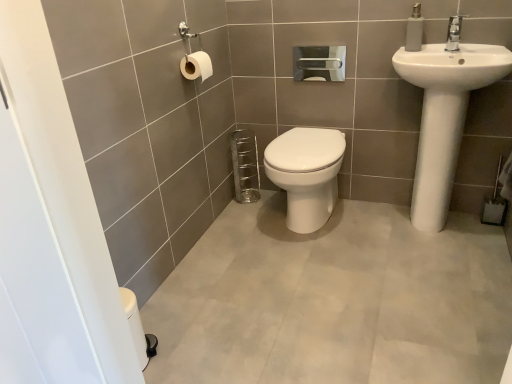
Describe the element at coordinates (414, 30) in the screenshot. I see `white matte soap dispenser at upper right` at that location.

What is the approximate height of white ceramic faucet at upper right?

white ceramic faucet at upper right is 5.00 inches in height.

Identify the location of white matte toilet paper at upper left, acting as the 2th toilet paper starting from the back. This screenshot has height=384, width=512. (196, 66).

Identify the location of white glossy toilet paper at upper center, which is counted as the first toilet paper, starting from the right. Image resolution: width=512 pixels, height=384 pixels. (319, 63).

From the image's perspective, is white matte toilet paper at upper left, acting as the 2th toilet paper starting from the back, above white glossy sink at upper right?

Yes, from the image's perspective, white matte toilet paper at upper left, acting as the 2th toilet paper starting from the back, is on top of white glossy sink at upper right.

From the picture: Considering the sizes of white matte toilet paper at upper left, acting as the 2th toilet paper starting from the back, and white glossy sink at upper right in the image, is white matte toilet paper at upper left, acting as the 2th toilet paper starting from the back, taller or shorter than white glossy sink at upper right?

In the image, white matte toilet paper at upper left, acting as the 2th toilet paper starting from the back, appears to be shorter than white glossy sink at upper right.

Is white matte toilet paper at upper left, the first toilet paper in the left-to-right sequence, turned away from white glossy sink at upper right?

No, white matte toilet paper at upper left, the first toilet paper in the left-to-right sequence, is not facing the opposite direction of white glossy sink at upper right.

Locate an element on the screen. The width and height of the screenshot is (512, 384). the 2nd toilet paper positioned above the white glossy sink at upper right (from a real-world perspective) is located at coordinates (196, 66).

From the picture: From the image's perspective, would you say white ceramic faucet at upper right is positioned over white glossy sink at upper right?

Yes.

Where is `sink below the white ceramic faucet at upper right (from the image's perspective)`? This screenshot has width=512, height=384. sink below the white ceramic faucet at upper right (from the image's perspective) is located at coordinates (444, 117).

How distant is white ceramic faucet at upper right from white glossy sink at upper right?

A distance of 11.04 inches exists between white ceramic faucet at upper right and white glossy sink at upper right.

From the image's perspective, is white matte soap dispenser at upper right above white glossy sink at upper right?

Yes, from the image's perspective, white matte soap dispenser at upper right is above white glossy sink at upper right.

Which of these two, white matte soap dispenser at upper right or white glossy sink at upper right, is bigger?

white glossy sink at upper right.

Who is shorter, white matte soap dispenser at upper right or white glossy sink at upper right?

With less height is white matte soap dispenser at upper right.

Is white matte soap dispenser at upper right situated inside white glossy sink at upper right or outside?

white matte soap dispenser at upper right is not inside white glossy sink at upper right, it's outside.

I want to click on soap dispenser above the white glossy sink at upper right (from a real-world perspective), so click(x=414, y=30).

Who is smaller, white glossy sink at upper right or white matte soap dispenser at upper right?

white matte soap dispenser at upper right is smaller.

Are white glossy sink at upper right and white matte soap dispenser at upper right located far from each other?

white glossy sink at upper right is near white matte soap dispenser at upper right, not far away.

Which is behind, point (403, 76) or point (413, 35)?

Positioned behind is point (413, 35).

Is white matte soap dispenser at upper right further to the viewer compared to white glossy toilet at center?

No, it is not.

Measure the distance from white matte soap dispenser at upper right to white glossy toilet at center.

The distance of white matte soap dispenser at upper right from white glossy toilet at center is 26.87 inches.

Would you say white matte soap dispenser at upper right is inside or outside white glossy toilet at center?

white matte soap dispenser at upper right is spatially situated outside white glossy toilet at center.

In terms of height, does white matte soap dispenser at upper right look taller or shorter compared to white glossy toilet at center?

Considering their sizes, white matte soap dispenser at upper right has less height than white glossy toilet at center.

Considering the sizes of objects white matte toilet paper at upper left, acting as the first toilet paper starting from the front, and white glossy toilet at center in the image provided, who is bigger, white matte toilet paper at upper left, acting as the first toilet paper starting from the front, or white glossy toilet at center?

white glossy toilet at center is bigger.

Between white matte toilet paper at upper left, acting as the first toilet paper starting from the front, and white glossy toilet at center, which one appears on the right side from the viewer's perspective?

white glossy toilet at center is more to the right.

Consider the image. From the image's perspective, which one is positioned higher, white matte toilet paper at upper left, the 2th toilet paper in the right-to-left sequence, or white glossy toilet at center?

white matte toilet paper at upper left, the 2th toilet paper in the right-to-left sequence.

Which object is further away from the camera, white glossy toilet at center or white glossy toilet at center?

Positioned behind is white glossy toilet at center.

Considering the relative sizes of white glossy toilet at center and white glossy toilet at center in the image provided, is white glossy toilet at center smaller than white glossy toilet at center?

Correct, white glossy toilet at center occupies less space than white glossy toilet at center.

Considering the relative positions of white glossy toilet at center and white glossy toilet at center in the image provided, is white glossy toilet at center to the left or to the right of white glossy toilet at center?

white glossy toilet at center is positioned on white glossy toilet at center's right side.

The image size is (512, 384). I want to click on sink that appears in front of the white matte toilet paper at upper left, acting as the 2th toilet paper starting from the back, so click(x=444, y=117).

The height and width of the screenshot is (384, 512). Identify the location of tap positioned vertically above the white glossy sink at upper right (from a real-world perspective). (454, 33).

Looking at the image, which one is located further to white glossy toilet at center, white matte toilet paper at upper left, acting as the first toilet paper starting from the front, or white matte soap dispenser at upper right?

white matte soap dispenser at upper right is further to white glossy toilet at center.

When comparing their distances from white glossy toilet at center, does white glossy sink at upper right or white glossy toilet paper at upper center, marked as the 2th toilet paper in a front-to-back arrangement, seem further?

Among the two, white glossy sink at upper right is located further to white glossy toilet at center.

Considering their positions, is white glossy sink at upper right positioned closer to white glossy toilet at center than white matte toilet paper at upper left, the first toilet paper in the left-to-right sequence?

white glossy sink at upper right is closer to white glossy toilet at center.

Estimate the real-world distances between objects in this image. Which object is closer to white glossy toilet paper at upper center, marked as the 2th toilet paper in a front-to-back arrangement, white matte soap dispenser at upper right or white glossy toilet at center?

Based on the image, white matte soap dispenser at upper right appears to be nearer to white glossy toilet paper at upper center, marked as the 2th toilet paper in a front-to-back arrangement.

In the scene shown: From the image, which object appears to be farther from white glossy toilet at center, white glossy toilet at center or white matte toilet paper at upper left, acting as the 2th toilet paper starting from the back?

white matte toilet paper at upper left, acting as the 2th toilet paper starting from the back.

Considering their positions, is white glossy toilet at center positioned closer to white ceramic faucet at upper right than white glossy sink at upper right?

white glossy sink at upper right is positioned closer to the anchor white ceramic faucet at upper right.

Based on their spatial positions, is white glossy toilet paper at upper center, which is the 1th toilet paper in back-to-front order, or white matte toilet paper at upper left, the 2th toilet paper in the right-to-left sequence, further from white glossy toilet at center?

Among the two, white matte toilet paper at upper left, the 2th toilet paper in the right-to-left sequence, is located further to white glossy toilet at center.

When comparing their distances from white glossy toilet at center, does white matte soap dispenser at upper right or white glossy toilet at center seem further?

white matte soap dispenser at upper right lies further to white glossy toilet at center than the other object.

Image resolution: width=512 pixels, height=384 pixels. I want to click on sink between white matte soap dispenser at upper right and white glossy toilet at center vertically, so (444, 117).

You are a GUI agent. You are given a task and a screenshot of the screen. Output one action in this format:
    pyautogui.click(x=<x>, y=<y>)
    Task: Click on the toilet paper between white matte toilet paper at upper left, the first toilet paper in the left-to-right sequence, and white ceramic faucet at upper right from left to right
    Image resolution: width=512 pixels, height=384 pixels.
    Given the screenshot: What is the action you would take?
    pyautogui.click(x=319, y=63)

The width and height of the screenshot is (512, 384). Identify the location of soap dispenser between white matte toilet paper at upper left, acting as the first toilet paper starting from the front, and white glossy sink at upper right from left to right. (414, 30).

Locate an element on the screen. This screenshot has height=384, width=512. bidet between white glossy toilet at center and white glossy toilet paper at upper center, which is the 1th toilet paper in back-to-front order, in the front-back direction is located at coordinates (306, 174).